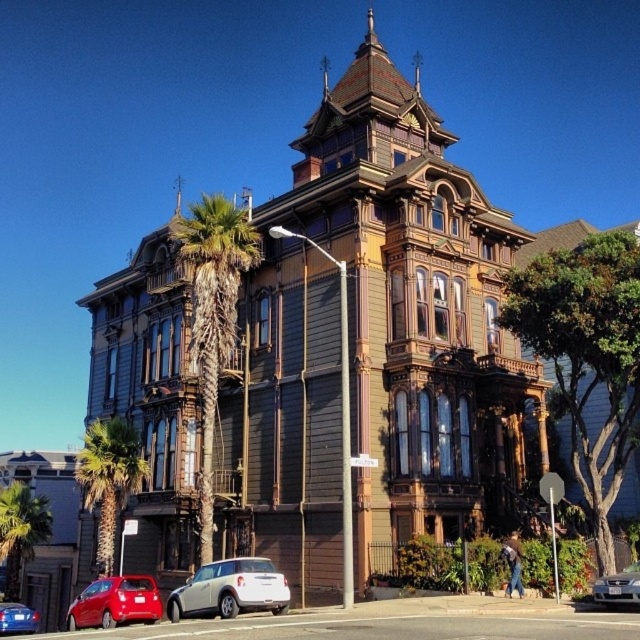
Is point (196, 586) positioned before point (22, 624)?

Yes.

Between white matte car at lower center and metallic blue sedan at lower left, which one has less height?

white matte car at lower center is shorter.

Locate an element on the screen. This screenshot has height=640, width=640. white matte car at lower center is located at coordinates pos(230,589).

Who is shorter, silver metallic sedan at lower right or metallic blue sedan at lower left?

With less height is silver metallic sedan at lower right.

Is silver metallic sedan at lower right closer to camera compared to metallic blue sedan at lower left?

Yes.

Who is more distant from viewer, (595,596) or (22,609)?

The point (22,609) is behind.

At what (x,y) coordinates should I click in order to perform the action: click on silver metallic sedan at lower right. Please return your answer as a coordinate pair (x, y). Image resolution: width=640 pixels, height=640 pixels. Looking at the image, I should click on (618, 586).

Measure the distance from green leafy palm tree at center to metallic blue sedan at lower left.

21.29 meters

Is green leafy palm tree at center bigger than metallic blue sedan at lower left?

No.

Where is `green leafy palm tree at center`? This screenshot has height=640, width=640. green leafy palm tree at center is located at coordinates (212, 314).